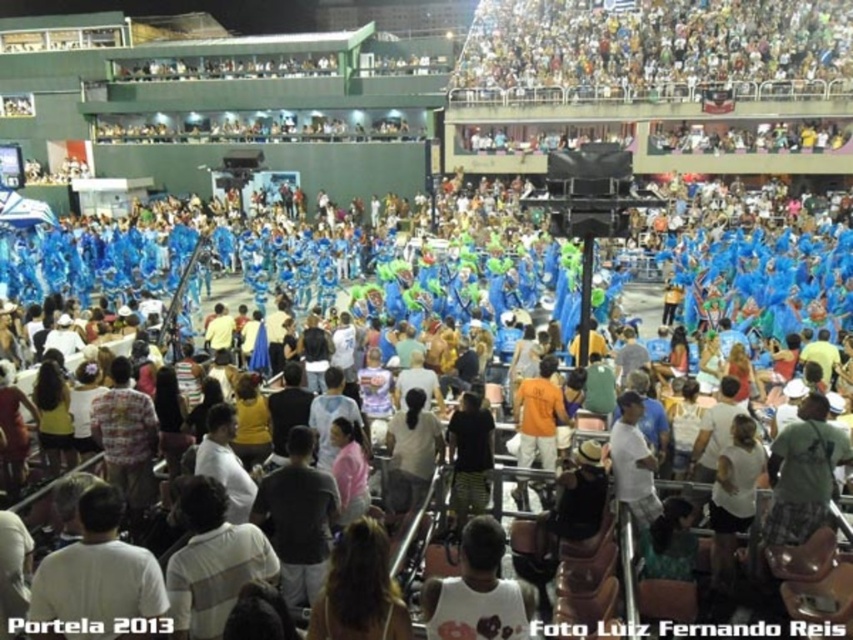
Question: From the image, what is the correct spatial relationship of white cotton tank top at center in relation to orange cotton shirt at center?

Choices:
 (A) above
 (B) below

Answer: (B)

Question: Which of the following is the closest to the observer?

Choices:
 (A) white cotton tank top at center
 (B) multicolored fabric crowd at upper center

Answer: (A)

Question: Does multicolored fabric crowd at upper center have a lesser width compared to white cotton tank top at center?

Choices:
 (A) yes
 (B) no

Answer: (B)

Question: Which point appears closest to the camera in this image?

Choices:
 (A) (526, 600)
 (B) (689, 76)

Answer: (A)

Question: Which point is closer to the camera?

Choices:
 (A) (546, 365)
 (B) (585, 88)
 (C) (521, 588)

Answer: (C)

Question: Can you confirm if white cotton tank top at center is positioned to the left of orange cotton shirt at center?

Choices:
 (A) no
 (B) yes

Answer: (B)